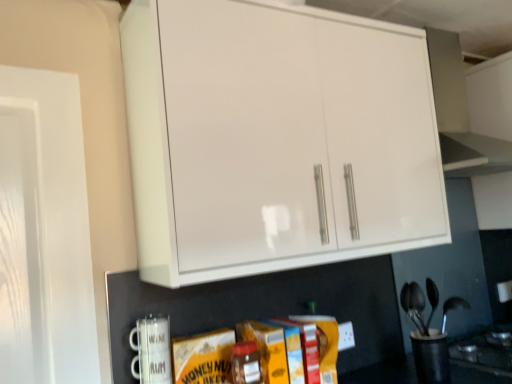
This screenshot has height=384, width=512. In order to click on black plastic utensil holder at lower right, acting as the 2th appliance starting from the top in this screenshot , I will do `click(431, 357)`.

What do you see at coordinates (431, 357) in the screenshot?
I see `black plastic utensil holder at lower right, the second appliance when ordered from front to back` at bounding box center [431, 357].

What do you see at coordinates (276, 138) in the screenshot?
I see `white glossy cabinet at upper center` at bounding box center [276, 138].

The width and height of the screenshot is (512, 384). What are the coordinates of `white ceramic mug at lower left, the first appliance from the front` in the screenshot? It's located at (152, 350).

Does white ceramic mug at lower left, marked as the 2th appliance in a right-to-left arrangement, have a lesser width compared to white glossy cabinet at upper center?

Indeed, white ceramic mug at lower left, marked as the 2th appliance in a right-to-left arrangement, has a lesser width compared to white glossy cabinet at upper center.

The width and height of the screenshot is (512, 384). I want to click on appliance that is the 1st one when counting backward from the white glossy cabinet at upper center, so click(152, 350).

From the image's perspective, is white ceramic mug at lower left, marked as the first appliance in a top-to-bottom arrangement, under white glossy cabinet at upper center?

Yes.

Considering the sizes of white glossy cabinet at upper center and black plastic utensil holder at lower right, the second appliance when ordered from front to back, in the image, is white glossy cabinet at upper center taller or shorter than black plastic utensil holder at lower right, the second appliance when ordered from front to back,?

In the image, white glossy cabinet at upper center appears to be taller than black plastic utensil holder at lower right, the second appliance when ordered from front to back.

Is white glossy cabinet at upper center positioned behind black plastic utensil holder at lower right, acting as the 2th appliance starting from the top?

No, white glossy cabinet at upper center is closer to the camera.

Which of these two, white glossy cabinet at upper center or black plastic utensil holder at lower right, the first appliance in the back-to-front sequence, is thinner?

With smaller width is black plastic utensil holder at lower right, the first appliance in the back-to-front sequence.

Between point (202, 179) and point (426, 355), which one is positioned behind?

The point (426, 355) is farther from the camera.

Who is shorter, matte glass jar at center or black plastic utensil holder at lower right, the second appliance when ordered from front to back?

With less height is matte glass jar at center.

Between matte glass jar at center and black plastic utensil holder at lower right, the first appliance in the back-to-front sequence, which one appears on the left side from the viewer's perspective?

Positioned to the left is matte glass jar at center.

From the image's perspective, does matte glass jar at center appear higher than black plastic utensil holder at lower right, the first appliance in the back-to-front sequence?

Yes, from the image's perspective, matte glass jar at center is above black plastic utensil holder at lower right, the first appliance in the back-to-front sequence.

Are matte glass jar at center and black plastic utensil holder at lower right, the second appliance when ordered from front to back, beside each other?

No, matte glass jar at center is not in contact with black plastic utensil holder at lower right, the second appliance when ordered from front to back.

Considering the sizes of objects matte glass jar at center and white ceramic mug at lower left, the first appliance from the front, in the image provided, who is smaller, matte glass jar at center or white ceramic mug at lower left, the first appliance from the front,?

white ceramic mug at lower left, the first appliance from the front.

Does matte glass jar at center contain white ceramic mug at lower left, the first appliance from the front?

No, white ceramic mug at lower left, the first appliance from the front, is located outside of matte glass jar at center.

The image size is (512, 384). Find the location of `bottle below the white ceramic mug at lower left, marked as the 2th appliance in a right-to-left arrangement (from a real-world perspective)`. bottle below the white ceramic mug at lower left, marked as the 2th appliance in a right-to-left arrangement (from a real-world perspective) is located at coordinates (246, 363).

Is white glossy cabinet at upper center directly adjacent to matte glass jar at center?

No.

Between white glossy cabinet at upper center and matte glass jar at center, which one is positioned behind?

matte glass jar at center.

Who is shorter, white glossy cabinet at upper center or matte glass jar at center?

Standing shorter between the two is matte glass jar at center.

Is white glossy cabinet at upper center turned away from matte glass jar at center?

No.

Which of these two, matte glass jar at center or white glossy cabinet at upper center, is thinner?

matte glass jar at center.

Which of these two, matte glass jar at center or white glossy cabinet at upper center, is smaller?

matte glass jar at center is smaller.

Is matte glass jar at center positioned before white glossy cabinet at upper center?

No.

Between white glossy cabinet at upper center and white ceramic mug at lower left, the second appliance viewed from the back, which one has smaller size?

white ceramic mug at lower left, the second appliance viewed from the back, is smaller.

Is white glossy cabinet at upper center not within white ceramic mug at lower left, the second appliance viewed from the back?

Yes, white glossy cabinet at upper center is not within white ceramic mug at lower left, the second appliance viewed from the back.

Is white glossy cabinet at upper center in contact with white ceramic mug at lower left, the 2th appliance when ordered from bottom to top?

No, white glossy cabinet at upper center is not touching white ceramic mug at lower left, the 2th appliance when ordered from bottom to top.

Between white glossy cabinet at upper center and white ceramic mug at lower left, marked as the first appliance in a top-to-bottom arrangement, which one has more height?

white glossy cabinet at upper center.

This screenshot has width=512, height=384. What are the coordinates of `cabinetry that is above the white ceramic mug at lower left, the first appliance from the front (from a real-world perspective)` in the screenshot? It's located at (276, 138).

You are a GUI agent. You are given a task and a screenshot of the screen. Output one action in this format:
    pyautogui.click(x=<x>, y=<y>)
    Task: Click on the appliance that is the 2nd object located behind the white glossy cabinet at upper center
    Image resolution: width=512 pixels, height=384 pixels.
    Given the screenshot: What is the action you would take?
    pyautogui.click(x=431, y=357)

Estimate the real-world distances between objects in this image. Which object is closer to white glossy cabinet at upper center, matte glass jar at center or white ceramic mug at lower left, the 2th appliance when ordered from bottom to top?

white ceramic mug at lower left, the 2th appliance when ordered from bottom to top.

Looking at the image, which one is located further to white glossy cabinet at upper center, white ceramic mug at lower left, positioned as the first appliance in left-to-right order, or black plastic utensil holder at lower right, the first appliance in the back-to-front sequence?

The object further to white glossy cabinet at upper center is black plastic utensil holder at lower right, the first appliance in the back-to-front sequence.

Estimate the real-world distances between objects in this image. Which object is further from black plastic utensil holder at lower right, the first appliance in the back-to-front sequence, white ceramic mug at lower left, marked as the 2th appliance in a right-to-left arrangement, or white glossy cabinet at upper center?

white ceramic mug at lower left, marked as the 2th appliance in a right-to-left arrangement, lies further to black plastic utensil holder at lower right, the first appliance in the back-to-front sequence, than the other object.

Looking at the image, which one is located further to white glossy cabinet at upper center, white ceramic mug at lower left, the first appliance from the front, or matte glass jar at center?

Among the two, matte glass jar at center is located further to white glossy cabinet at upper center.

Estimate the real-world distances between objects in this image. Which object is closer to black plastic utensil holder at lower right, the second appliance when ordered from front to back, white glossy cabinet at upper center or matte glass jar at center?

matte glass jar at center.

Estimate the real-world distances between objects in this image. Which object is further from matte glass jar at center, white glossy cabinet at upper center or black plastic utensil holder at lower right, which is the first appliance from right to left?

Based on the image, white glossy cabinet at upper center appears to be further to matte glass jar at center.

Consider the image. Based on their spatial positions, is white glossy cabinet at upper center or black plastic utensil holder at lower right, which appears as the 2th appliance when viewed from the left, further from white ceramic mug at lower left, the first appliance from the front?

black plastic utensil holder at lower right, which appears as the 2th appliance when viewed from the left, is further to white ceramic mug at lower left, the first appliance from the front.

Which object lies further to the anchor point white glossy cabinet at upper center, black plastic utensil holder at lower right, the second appliance when ordered from front to back, or white ceramic mug at lower left, marked as the first appliance in a top-to-bottom arrangement?

black plastic utensil holder at lower right, the second appliance when ordered from front to back.

You are a GUI agent. You are given a task and a screenshot of the screen. Output one action in this format:
    pyautogui.click(x=<x>, y=<y>)
    Task: Click on the bottle between white glossy cabinet at upper center and black plastic utensil holder at lower right, acting as the 2th appliance starting from the top, in the up-down direction
    This screenshot has width=512, height=384.
    Given the screenshot: What is the action you would take?
    click(x=246, y=363)

The width and height of the screenshot is (512, 384). What are the coordinates of `cabinetry situated between white ceramic mug at lower left, the 2th appliance when ordered from bottom to top, and black plastic utensil holder at lower right, acting as the 2th appliance starting from the top, from left to right` in the screenshot? It's located at (276, 138).

This screenshot has height=384, width=512. In order to click on bottle between white ceramic mug at lower left, the 2th appliance when ordered from bottom to top, and black plastic utensil holder at lower right, which is the first appliance from right to left, from left to right in this screenshot , I will do `click(246, 363)`.

Find the location of a particular element. Image resolution: width=512 pixels, height=384 pixels. appliance between white glossy cabinet at upper center and matte glass jar at center from top to bottom is located at coordinates (152, 350).